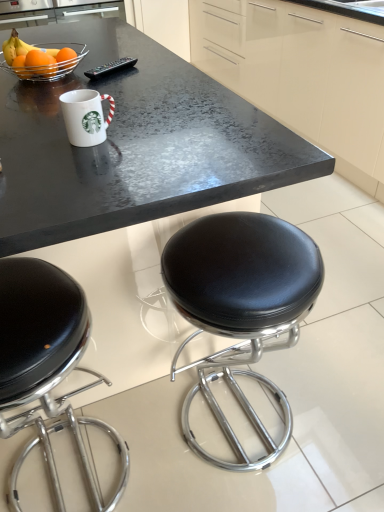
The height and width of the screenshot is (512, 384). I want to click on vacant space in front of black plastic remote control at upper center, so pos(123,81).